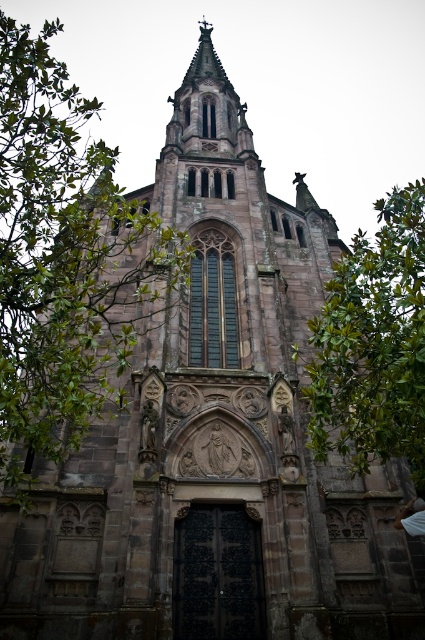
Question: Is green leafy tree at left positioned behind green leafy tree at right?

Choices:
 (A) no
 (B) yes

Answer: (B)

Question: Is green leafy tree at left wider than green leafy tree at right?

Choices:
 (A) yes
 (B) no

Answer: (B)

Question: Does green leafy tree at left appear under green leafy tree at right?

Choices:
 (A) no
 (B) yes

Answer: (A)